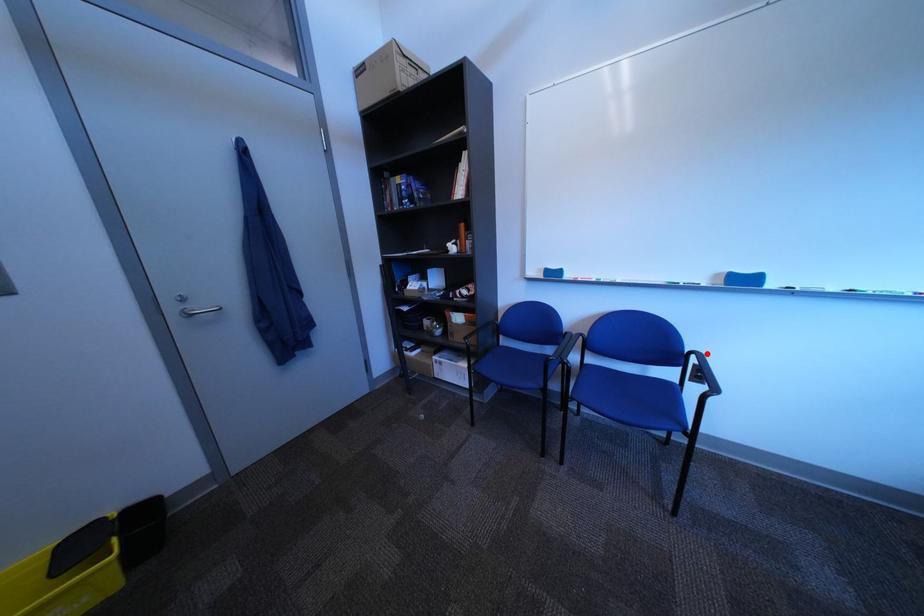
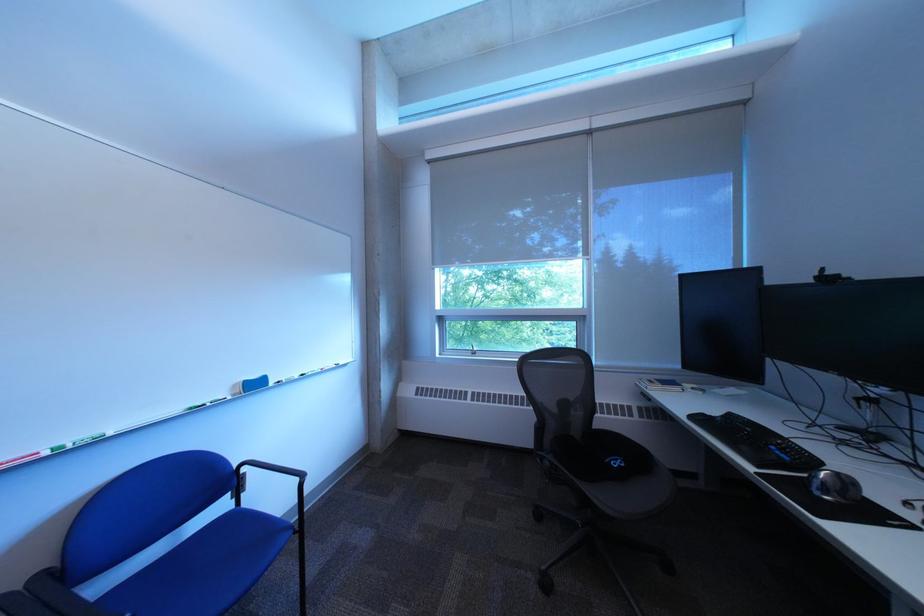
Locate, in the second image, the point that corresponds to the highlighted location in the first image.

(257, 467)